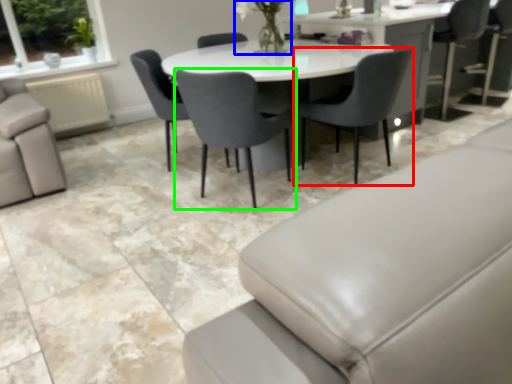
Question: Based on their relative distances, which object is nearer to chair (highlighted by a red box)? Choose from floral arrangement (highlighted by a blue box) and chair (highlighted by a green box).

Choices:
 (A) floral arrangement
 (B) chair

Answer: (B)